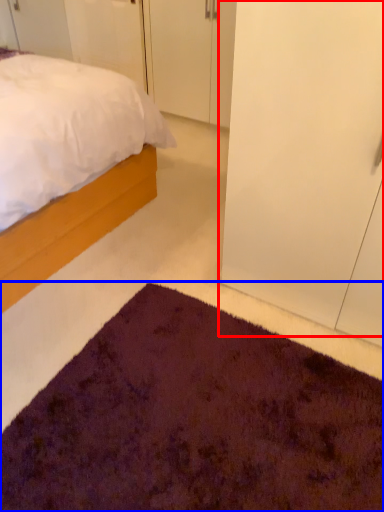
Question: Among these objects, which one is nearest to the camera, glass door (highlighted by a red box) or doormat (highlighted by a blue box)?

Choices:
 (A) glass door
 (B) doormat

Answer: (B)